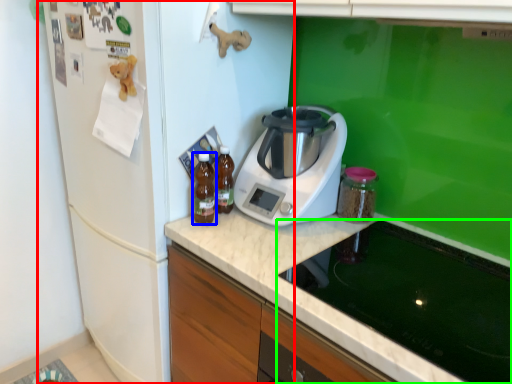
Question: Considering the real-world distances, which object is farthest from fridge (highlighted by a red box)? kitchen appliance (highlighted by a blue box) or home appliance (highlighted by a green box)?

Choices:
 (A) kitchen appliance
 (B) home appliance

Answer: (B)